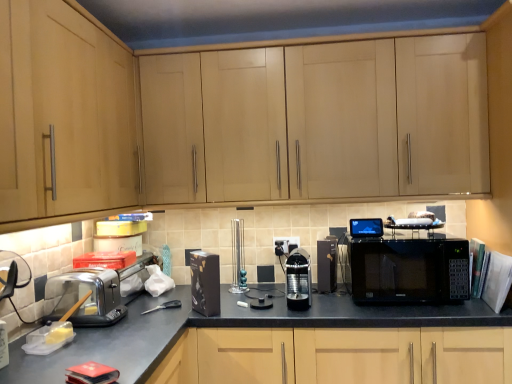
Identify the location of free spot below sleek black coffee machine at center, the 2th appliance positioned from the right (from a real-world perspective). Image resolution: width=512 pixels, height=384 pixels. (296, 304).